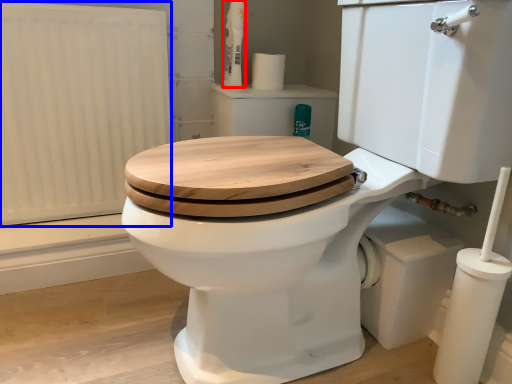
Question: Among these objects, which one is farthest to the camera, toiletry (highlighted by a red box) or radiator (highlighted by a blue box)?

Choices:
 (A) toiletry
 (B) radiator

Answer: (A)